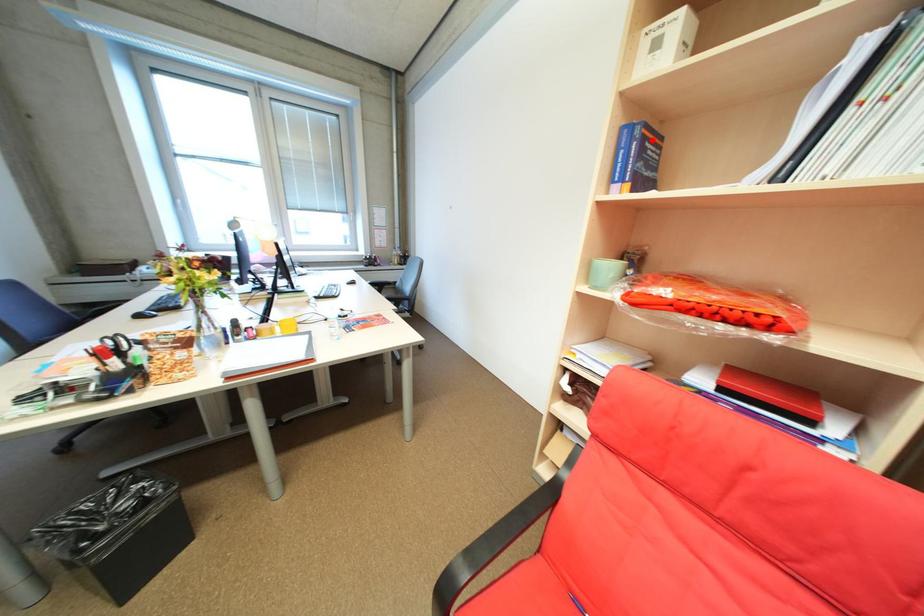
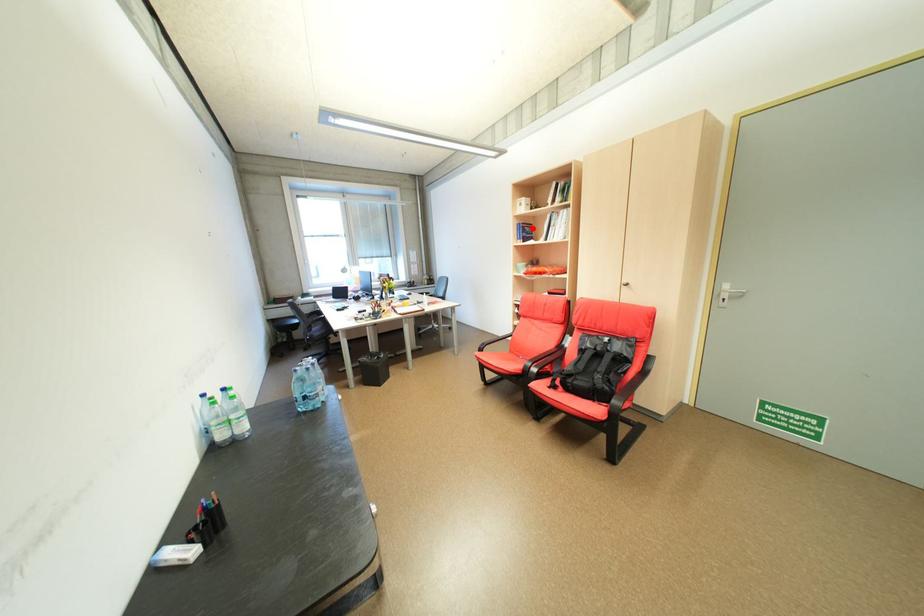
I am providing you with two images of the same scene from different viewpoints. A red point is marked on the first image and another point is marked on the second image. Is the red point in image1 aligned with the point shown in image2?

Yes